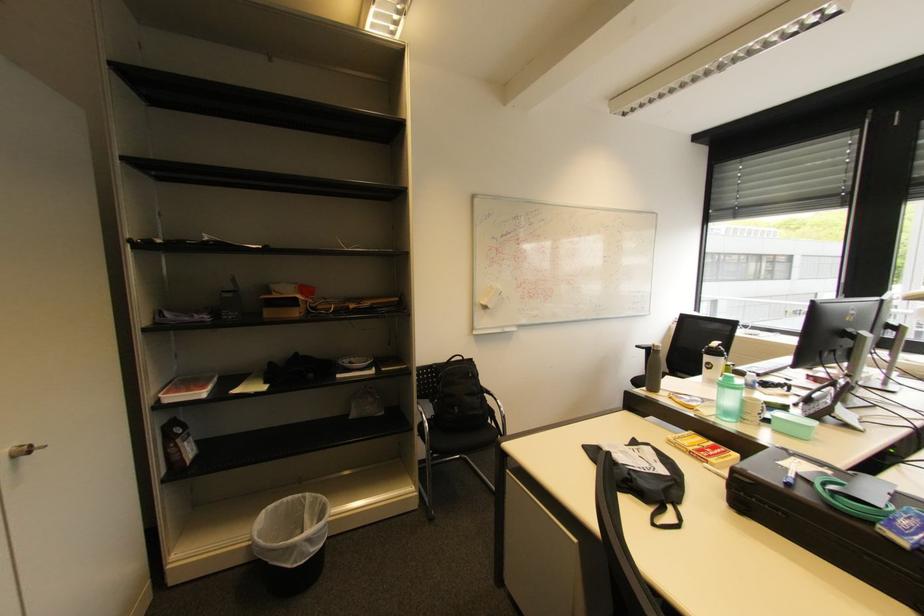
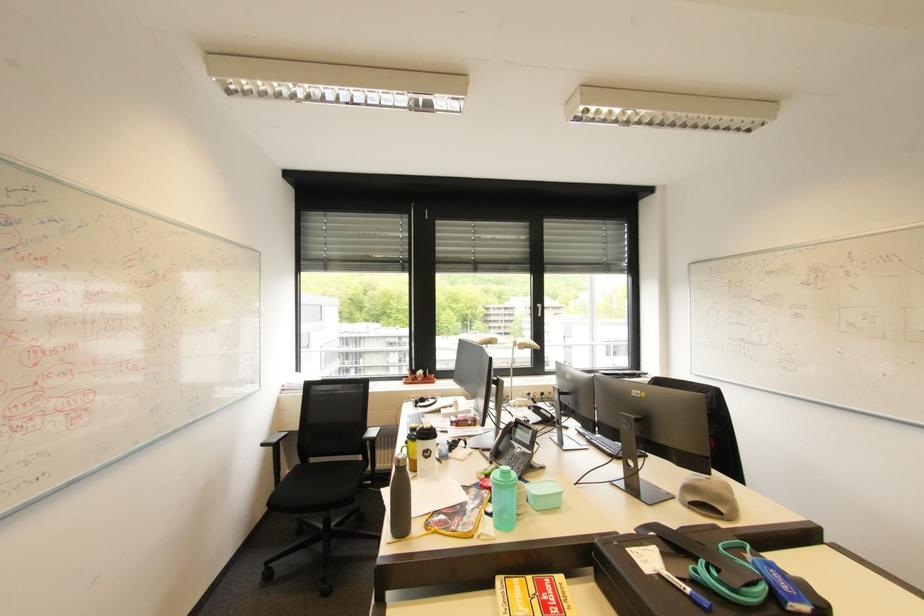
The point at (x=820, y=398) is marked in the first image. Where is the corresponding point in the second image?

(505, 448)